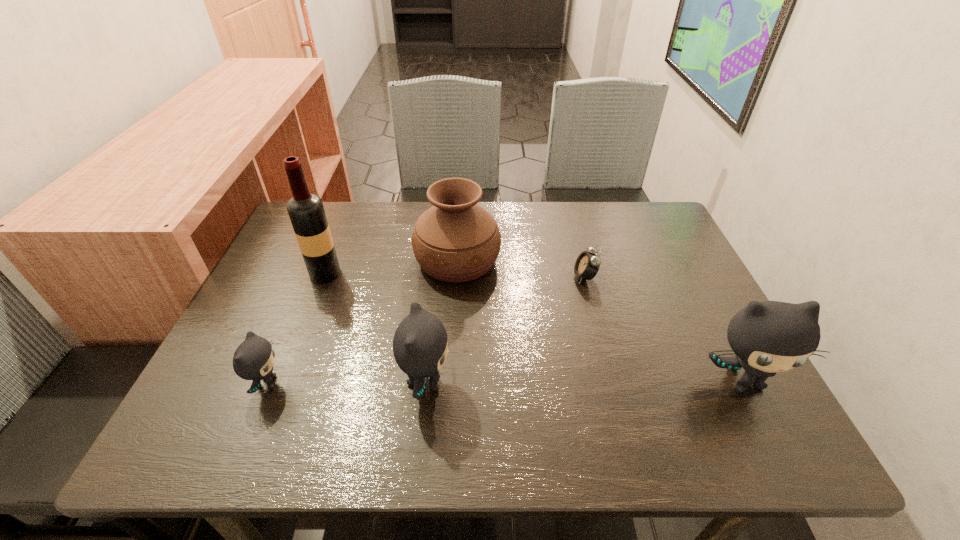
Identify the location of the fifth tallest object. pos(254,358).

Find the location of a particular element. the leftmost kitten is located at coordinates (254, 358).

Find the location of `the third shortest object`. the third shortest object is located at coordinates (420, 349).

Where is `the second shortest kitten`? The width and height of the screenshot is (960, 540). the second shortest kitten is located at coordinates (420, 349).

You are a GUI agent. You are given a task and a screenshot of the screen. Output one action in this format:
    pyautogui.click(x=<x>, y=<y>)
    Task: Click on the rightmost kitten
    The height and width of the screenshot is (540, 960).
    Given the screenshot: What is the action you would take?
    pyautogui.click(x=767, y=337)

The height and width of the screenshot is (540, 960). In order to click on the tallest object in this screenshot , I will do `click(306, 211)`.

The image size is (960, 540). Identify the location of urn. (456, 240).

The image size is (960, 540). What are the coordinates of `alarm clock` in the screenshot? It's located at [x=587, y=264].

Identify the location of the second object from right to left. (587, 264).

The width and height of the screenshot is (960, 540). In order to click on free region located 0.210m on the front-facing side of the leftmost kitten in this screenshot , I will do `click(387, 383)`.